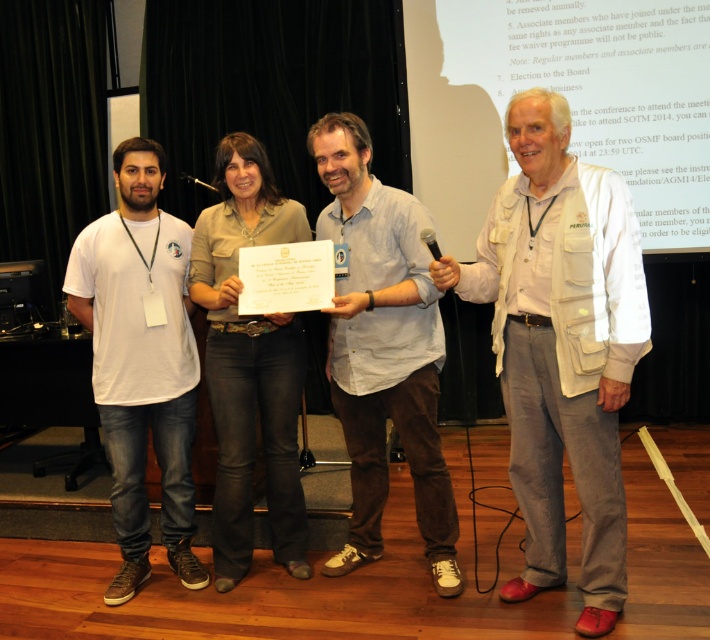
Question: Which object appears farthest from the camera in this image?

Choices:
 (A) black plastic microphone at upper center
 (B) white textured vest at center
 (C) white cotton shirt at center

Answer: (C)

Question: Which object is farther from the camera taking this photo?

Choices:
 (A) black plastic microphone at upper center
 (B) metallic at left
 (C) white cotton t-shirt at left
 (D) white textured vest at center

Answer: (B)

Question: Which point appears farthest from the camera in this image?

Choices:
 (A) (432, 252)
 (B) (422, 224)

Answer: (B)

Question: Is white cotton shirt at center closer to camera compared to white cotton t-shirt at left?

Choices:
 (A) yes
 (B) no

Answer: (A)

Question: Is white textured vest at center bigger than white cotton shirt at center?

Choices:
 (A) no
 (B) yes

Answer: (B)

Question: Observing the image, what is the correct spatial positioning of white cotton shirt at center in reference to metallic at left?

Choices:
 (A) left
 (B) right

Answer: (B)